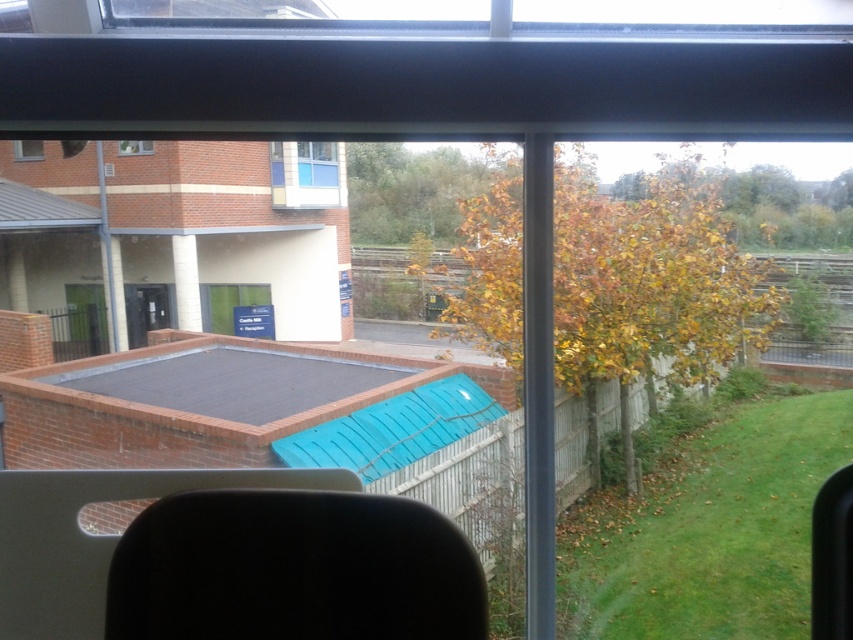
Between clear glass window at upper left and clear glass window at upper center, which one has more height?

clear glass window at upper left

Is point (39, 156) less distant than point (146, 154)?

No, it is behind (146, 154).

Locate an element on the screen. The width and height of the screenshot is (853, 640). clear glass window at upper left is located at coordinates (28, 148).

Is point (323, 186) farther from viewer compared to point (140, 150)?

Yes, it is.

Between clear glass window at center and clear glass window at upper center, which one is positioned lower?

clear glass window at upper center is below.

Is point (315, 172) farther from camera compared to point (119, 141)?

That is True.

What are the coordinates of `clear glass window at center` in the screenshot? It's located at (317, 163).

Which is in front, point (271, 147) or point (326, 145)?

Positioned in front is point (326, 145).

Which is above, white plastic window at center or clear glass window at center?

clear glass window at center is higher up.

Image resolution: width=853 pixels, height=640 pixels. Find the location of `white plastic window at center`. white plastic window at center is located at coordinates (306, 173).